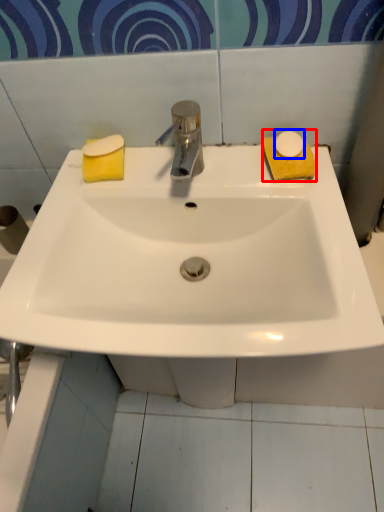
Question: Which point is further to the camera, soap (highlighted by a red box) or soap (highlighted by a blue box)?

Choices:
 (A) soap
 (B) soap

Answer: (A)